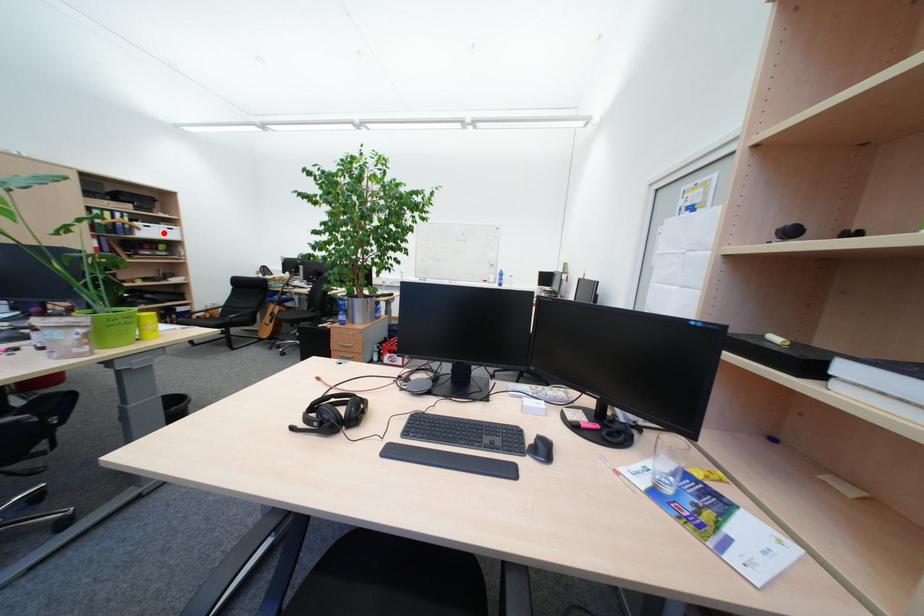
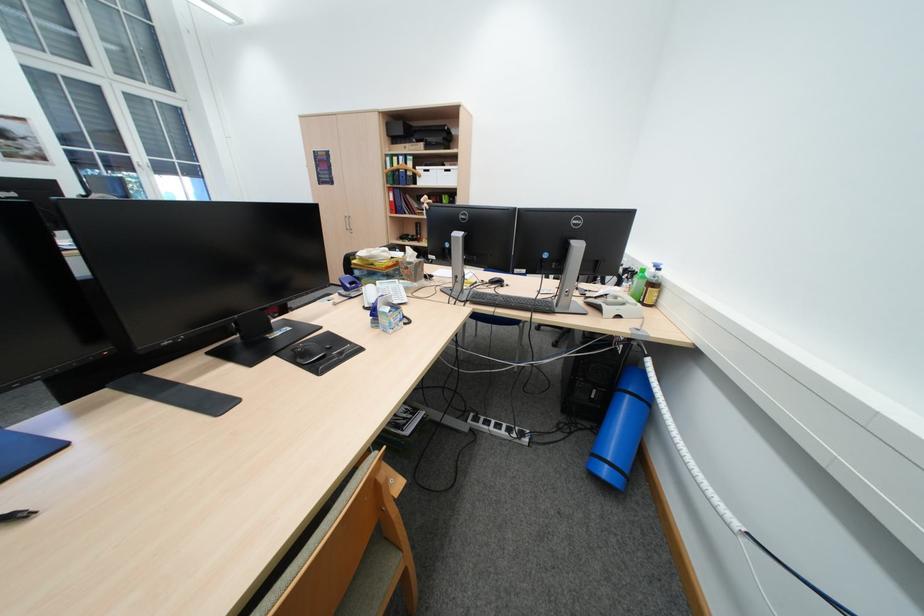
Question: I am providing you with two images of the same scene from different viewpoints. A red point is shown in image1. For the corresponding object point in image2, is it positioned nearer or farther from the camera?

Choices:
 (A) Nearer
 (B) Farther

Answer: (A)